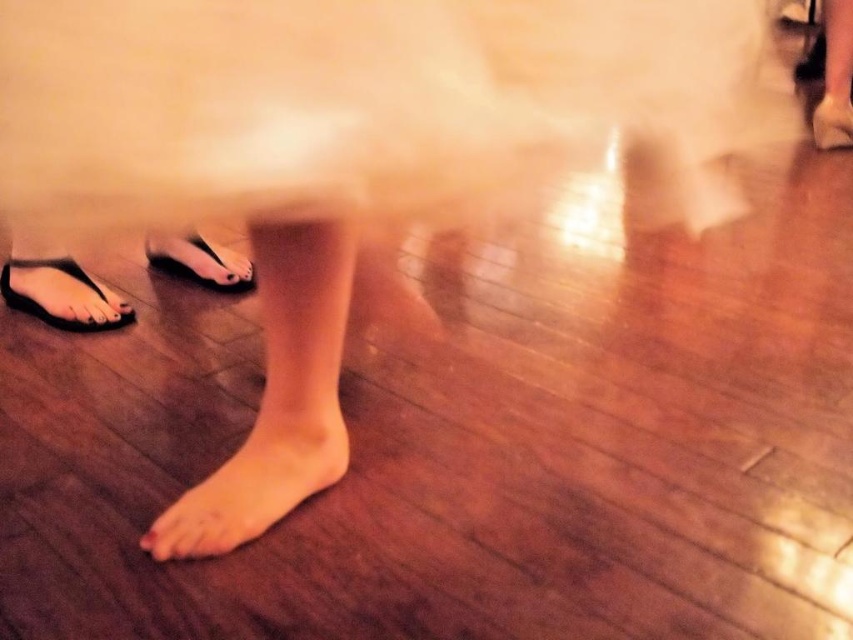
Question: Is matte black dress at center to the right of smooth skin foot at center from the viewer's perspective?

Choices:
 (A) yes
 (B) no

Answer: (A)

Question: Which point is farther to the camera?

Choices:
 (A) (759, 58)
 (B) (341, 474)

Answer: (B)

Question: Which point is closer to the camera taking this photo?

Choices:
 (A) (180, 240)
 (B) (207, 500)
 (C) (55, 324)
 (D) (819, 102)

Answer: (B)

Question: Is smooth skin foot at center to the right of black rubber flip-flop at lower left from the viewer's perspective?

Choices:
 (A) no
 (B) yes

Answer: (B)

Question: Which object appears farthest from the camera in this image?

Choices:
 (A) smooth skin foot at lower right
 (B) matte black dress at center

Answer: (A)

Question: Can you confirm if smooth skin foot at center is wider than black rubber flip-flop at lower left?

Choices:
 (A) no
 (B) yes

Answer: (A)